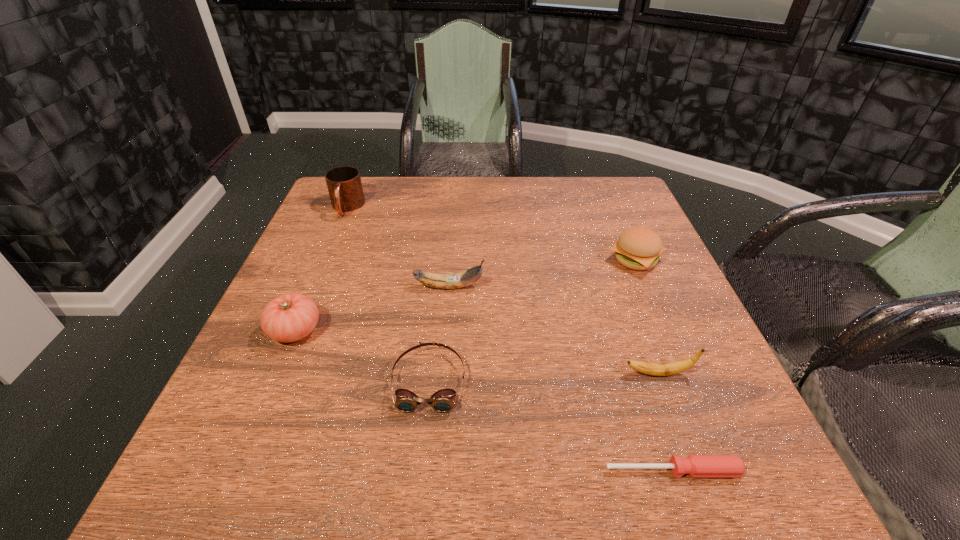
The height and width of the screenshot is (540, 960). What are the coordinates of `vacant area at the left edge` in the screenshot? It's located at (294, 395).

Locate an element on the screen. This screenshot has height=540, width=960. free region at the right edge of the desktop is located at coordinates (613, 241).

In the image, there is a desktop. At what (x,y) coordinates should I click in order to perform the action: click on vacant area at the far left corner. Please return your answer as a coordinate pair (x, y). Looking at the image, I should click on (322, 213).

At what (x,y) coordinates should I click in order to perform the action: click on vacant space at the far right corner of the desktop. Please return your answer as a coordinate pair (x, y). Looking at the image, I should click on (591, 200).

This screenshot has width=960, height=540. I want to click on unoccupied area between the second shortest object and the left banana, so click(x=440, y=334).

In order to click on free space that is in between the mug and the right banana in this screenshot , I will do `click(502, 291)`.

Find the location of a particular element. free space between the nearer banana and the tomato is located at coordinates (477, 352).

At what (x,y) coordinates should I click in order to perform the action: click on free space that is in between the tomato and the farther banana. Please return your answer as a coordinate pair (x, y). This screenshot has height=540, width=960. Looking at the image, I should click on coord(372,309).

You are a GUI agent. You are given a task and a screenshot of the screen. Output one action in this format:
    pyautogui.click(x=<x>, y=<y>)
    Task: Click on the vacant space that's between the tomato and the second shortest object
    Image resolution: width=960 pixels, height=540 pixels.
    Given the screenshot: What is the action you would take?
    pyautogui.click(x=362, y=355)

At what (x,y) coordinates should I click in order to perform the action: click on vacant area that lies between the sixth tallest object and the hamburger. Please return your answer as a coordinate pair (x, y). The image size is (960, 540). Looking at the image, I should click on click(532, 320).